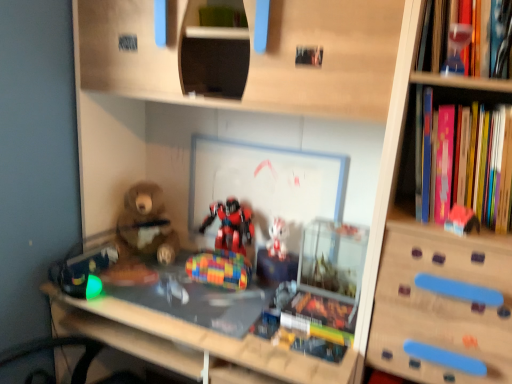
Image resolution: width=512 pixels, height=384 pixels. What do you see at coordinates (461, 220) in the screenshot?
I see `pink plastic toy at right, the 5th toy from the back` at bounding box center [461, 220].

What do you see at coordinates (205, 327) in the screenshot? The height and width of the screenshot is (384, 512). I see `clear glass table at center` at bounding box center [205, 327].

Image resolution: width=512 pixels, height=384 pixels. Describe the element at coordinates (220, 269) in the screenshot. I see `multicolored plastic cube at center, the second toy from the left` at that location.

Where is `brown plush bear at left, the 4th toy positioned from the front`? brown plush bear at left, the 4th toy positioned from the front is located at coordinates (146, 227).

This screenshot has height=384, width=512. Describe the element at coordinates (146, 227) in the screenshot. I see `brown plush bear at left, placed as the 1th toy when sorted from left to right` at that location.

This screenshot has width=512, height=384. I want to click on wooden bookshelf at right, so click(439, 293).

Could you tell me if hardcover book at center, marked as the second book in a right-to-left arrangement, is facing wooden bookshelf at right?

No, hardcover book at center, marked as the second book in a right-to-left arrangement, is not turned towards wooden bookshelf at right.

Is hardcover book at center, which is the 1th book in left-to-right order, at the right side of wooden bookshelf at right?

In fact, hardcover book at center, which is the 1th book in left-to-right order, is to the left of wooden bookshelf at right.

Is hardcover book at center, arranged as the 2th book when viewed from the top, placed right next to wooden bookshelf at right?

No, hardcover book at center, arranged as the 2th book when viewed from the top, is not making contact with wooden bookshelf at right.

Would you say hardcover book at center, which is the 1th book in left-to-right order, is outside wooden bookshelf at right?

Absolutely, hardcover book at center, which is the 1th book in left-to-right order, is external to wooden bookshelf at right.

Which of these two, clear glass table at center or hardcover book at center, which is the 1th book in left-to-right order, stands taller?

Standing taller between the two is clear glass table at center.

From the picture: Is clear glass table at center in front of or behind hardcover book at center, placed as the first book when sorted from bottom to top, in the image?

clear glass table at center is in front of hardcover book at center, placed as the first book when sorted from bottom to top.

Based on their sizes in the image, would you say clear glass table at center is bigger or smaller than hardcover book at center, placed as the first book when sorted from bottom to top?

Considering their sizes, clear glass table at center takes up more space than hardcover book at center, placed as the first book when sorted from bottom to top.

Which is closer to the camera, [148,289] or [282,321]?

Point [148,289].

Between brown plush bear at left, placed as the 1th toy when sorted from left to right, and multicolored plastic cube at center, the fifth toy when ordered from right to left, which one has less height?

With less height is multicolored plastic cube at center, the fifth toy when ordered from right to left.

Which object is wider, brown plush bear at left, the 4th toy positioned from the front, or multicolored plastic cube at center, the second toy from the left?

brown plush bear at left, the 4th toy positioned from the front, is wider.

From the image's perspective, which is above, brown plush bear at left, the 4th toy positioned from the front, or multicolored plastic cube at center, the second toy from the left?

brown plush bear at left, the 4th toy positioned from the front, from the image's perspective.

Is brown plush bear at left, placed as the 1th toy when sorted from left to right, bigger or smaller than multicolored plastic cube at center, acting as the 3th toy starting from the front?

In the image, brown plush bear at left, placed as the 1th toy when sorted from left to right, appears to be larger than multicolored plastic cube at center, acting as the 3th toy starting from the front.

Relative to shiny plastic robot at center, which is the 6th toy in front-to-back order, is pink plastic toy at right, acting as the 2th toy starting from the front, in front or behind?

pink plastic toy at right, acting as the 2th toy starting from the front, is in front of shiny plastic robot at center, which is the 6th toy in front-to-back order.

Is pink plastic toy at right, the 5th toy from the back, thinner than shiny plastic robot at center, acting as the third toy starting from the left?

Indeed, pink plastic toy at right, the 5th toy from the back, has a lesser width compared to shiny plastic robot at center, acting as the third toy starting from the left.

The height and width of the screenshot is (384, 512). Identify the location of toy that is the 4th one when counting backward from the pink plastic toy at right, placed as the first toy when sorted from right to left. (231, 225).

From a real-world perspective, which is physically below, pink plastic toy at right, placed as the first toy when sorted from right to left, or shiny plastic robot at center, which is counted as the 1th toy, starting from the back?

shiny plastic robot at center, which is counted as the 1th toy, starting from the back, is physically lower.

Does transparent glass hourglass at upper right, placed as the sixth toy when sorted from back to front, have a greater height compared to wooden bookshelf at right?

Incorrect, the height of transparent glass hourglass at upper right, placed as the sixth toy when sorted from back to front, is not larger of that of wooden bookshelf at right.

From the image's perspective, relative to wooden bookshelf at right, is transparent glass hourglass at upper right, placed as the sixth toy when sorted from back to front, above or below?

Clearly, from the image's perspective, transparent glass hourglass at upper right, placed as the sixth toy when sorted from back to front, is above wooden bookshelf at right.

The width and height of the screenshot is (512, 384). In order to click on the 5th toy above the wooden bookshelf at right (from the image's perspective) in this screenshot , I will do `click(457, 48)`.

How far apart are transparent glass hourglass at upper right, placed as the sixth toy when sorted from back to front, and wooden bookshelf at right?

A distance of 52.07 centimeters exists between transparent glass hourglass at upper right, placed as the sixth toy when sorted from back to front, and wooden bookshelf at right.

Is transparent glass hourglass at upper right, which appears as the 2th toy when viewed from the right, inside or outside of clear glass table at center?

transparent glass hourglass at upper right, which appears as the 2th toy when viewed from the right, exists outside the volume of clear glass table at center.

Is transparent glass hourglass at upper right, acting as the 5th toy starting from the left, to the right of clear glass table at center from the viewer's perspective?

Indeed, transparent glass hourglass at upper right, acting as the 5th toy starting from the left, is positioned on the right side of clear glass table at center.

From a real-world perspective, which toy is the 6th one above the clear glass table at center? Please provide its 2D coordinates.

[(457, 48)]

Is transparent glass hourglass at upper right, which appears as the 2th toy when viewed from the right, oriented towards clear glass table at center?

No, transparent glass hourglass at upper right, which appears as the 2th toy when viewed from the right, is not turned towards clear glass table at center.

This screenshot has height=384, width=512. What are the coordinates of `bookcase above the white plush toy at center, placed as the 2th toy when sorted from back to front (from a real-world perspective)` in the screenshot? It's located at (439, 293).

How different are the orientations of wooden bookshelf at right and white plush toy at center, which is the third toy in right-to-left order, in degrees?

1.54 degrees.

From the picture: Which is correct: wooden bookshelf at right is inside white plush toy at center, which is the third toy in right-to-left order, or outside of it?

The correct answer is: outside.

At what (x,y) coordinates should I click in order to perform the action: click on bookcase that is above the hardcover book at center, marked as the second book in a right-to-left arrangement (from the image's perspective). Please return your answer as a coordinate pair (x, y). Looking at the image, I should click on (439, 293).

The height and width of the screenshot is (384, 512). Find the location of `table that is under the hardcover book at center, marked as the second book in a right-to-left arrangement (from a real-world perspective)`. table that is under the hardcover book at center, marked as the second book in a right-to-left arrangement (from a real-world perspective) is located at coordinates (205, 327).

Looking at the image, which one is located further to wooden bookshelf at right, shiny plastic robot at center, which is counted as the 1th toy, starting from the back, or transparent glass hourglass at upper right, placed as the sixth toy when sorted from back to front?

Among the two, shiny plastic robot at center, which is counted as the 1th toy, starting from the back, is located further to wooden bookshelf at right.

Based on their spatial positions, is pink plastic toy at right, the 5th toy from the back, or multicolored plastic cube at center, the 4th toy when ordered from back to front, further from brown plush bear at left, the 4th toy positioned from the front?

Among the two, pink plastic toy at right, the 5th toy from the back, is located further to brown plush bear at left, the 4th toy positioned from the front.

From the image, which object appears to be farther from wooden bookshelf at right, shiny plastic robot at center, which is counted as the 1th toy, starting from the back, or brown plush bear at left, placed as the 1th toy when sorted from left to right?

brown plush bear at left, placed as the 1th toy when sorted from left to right, is positioned further to the anchor wooden bookshelf at right.

From the image, which object appears to be farther from pink plastic toy at right, placed as the first toy when sorted from right to left, shiny plastic robot at center, acting as the third toy starting from the left, or clear glass table at center?

Based on the image, shiny plastic robot at center, acting as the third toy starting from the left, appears to be further to pink plastic toy at right, placed as the first toy when sorted from right to left.

From the image, which object appears to be farther from clear glass table at center, brown plush bear at left, the 4th toy positioned from the front, or pink plastic toy at right, acting as the 2th toy starting from the front?

Among the two, pink plastic toy at right, acting as the 2th toy starting from the front, is located further to clear glass table at center.

Estimate the real-world distances between objects in this image. Which object is further from pink plastic toy at right, the 5th toy from the back, shiny plastic robot at center, which is the 6th toy in front-to-back order, or brown plush bear at left, the 6th toy when ordered from right to left?

Based on the image, brown plush bear at left, the 6th toy when ordered from right to left, appears to be further to pink plastic toy at right, the 5th toy from the back.

Which object lies further to the anchor point pink plastic toy at right, acting as the 2th toy starting from the front, white plush toy at center, which is the fifth toy in front-to-back order, or transparent glass hourglass at upper right, acting as the 5th toy starting from the left?

Among the two, white plush toy at center, which is the fifth toy in front-to-back order, is located further to pink plastic toy at right, acting as the 2th toy starting from the front.

Estimate the real-world distances between objects in this image. Which object is further from clear glass table at center, white plush toy at center, which is the third toy in right-to-left order, or wooden bookshelf at right?

The object further to clear glass table at center is wooden bookshelf at right.

Where is `book situated between multicolored plastic cube at center, the fifth toy when ordered from right to left, and pink cardboard house at right, which is the 1th book in top-to-bottom order, from left to right`? book situated between multicolored plastic cube at center, the fifth toy when ordered from right to left, and pink cardboard house at right, which is the 1th book in top-to-bottom order, from left to right is located at coordinates (320, 317).

Where is `book between brown plush bear at left, which is the third toy in back-to-front order, and transparent glass hourglass at upper right, placed as the sixth toy when sorted from back to front`? This screenshot has width=512, height=384. book between brown plush bear at left, which is the third toy in back-to-front order, and transparent glass hourglass at upper right, placed as the sixth toy when sorted from back to front is located at coordinates (320, 317).

The image size is (512, 384). Identify the location of book between wooden bookshelf at right and pink plastic toy at right, placed as the first toy when sorted from right to left, along the z-axis. click(467, 162).

The image size is (512, 384). Find the location of `book positioned between wooden bookshelf at right and hardcover book at center, placed as the first book when sorted from bottom to top, from near to far`. book positioned between wooden bookshelf at right and hardcover book at center, placed as the first book when sorted from bottom to top, from near to far is located at coordinates (467, 162).